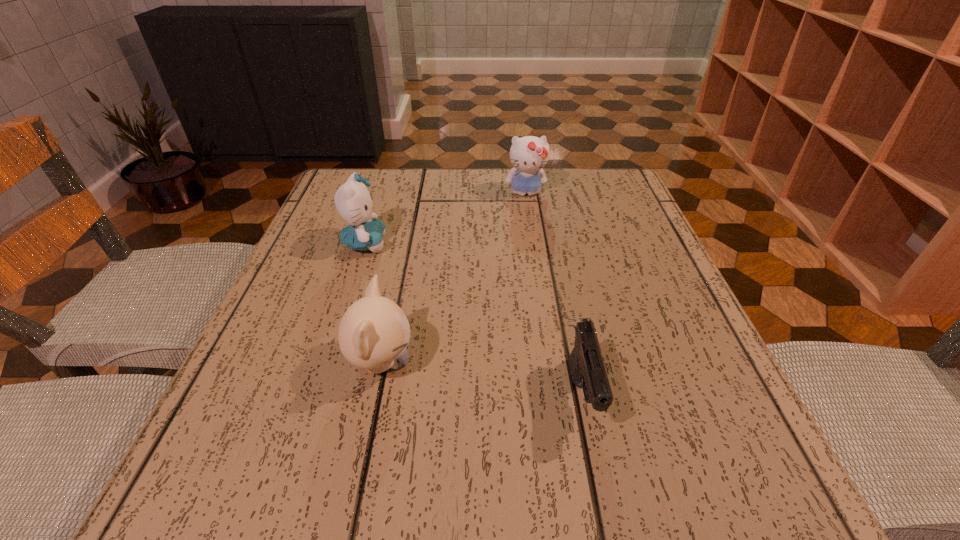
What are the coordinates of `vacant space that satisfies the following two spatial constraints: 1. on the front-facing side of the farthest object; 2. on the face of the nearest kitten` in the screenshot? It's located at (551, 363).